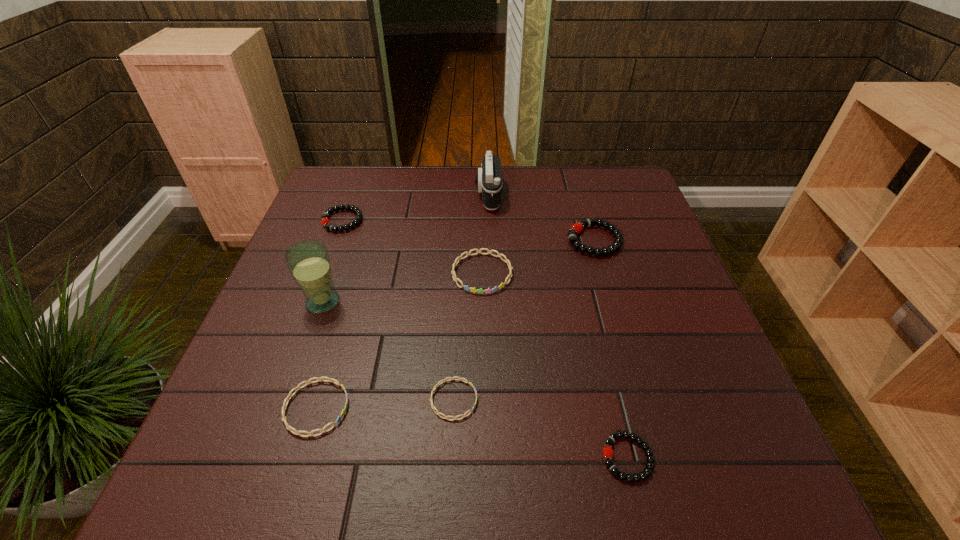
Where is `empty location between the second smallest black bracelet and the biggest black bracelet`? The width and height of the screenshot is (960, 540). empty location between the second smallest black bracelet and the biggest black bracelet is located at coordinates (468, 231).

Locate an element on the screen. The width and height of the screenshot is (960, 540). the second closest object to the leftmost blue bracelet is located at coordinates (308, 261).

Locate an element on the screen. The image size is (960, 540). the third closest object to the second biggest black bracelet is located at coordinates (489, 177).

At what (x,y) coordinates should I click in order to perform the action: click on bracelet that is the fifth closest to the nearest black bracelet. Please return your answer as a coordinate pair (x, y). The image size is (960, 540). Looking at the image, I should click on (325, 221).

In order to click on bracelet that is the fifth closest to the smallest black bracelet in this screenshot , I will do `click(325, 221)`.

Locate which black bracelet ranks second in proximity to the shortest object. Please provide its 2D coordinates. Your answer should be formatted as a tuple, i.e. [(x, y)], where the tuple contains the x and y coordinates of a point satisfying the conditions above.

[(577, 227)]

Locate an element on the screen. This screenshot has height=540, width=960. the closest black bracelet relative to the biggest blue bracelet is located at coordinates (577, 227).

At what (x,y) coordinates should I click in order to perform the action: click on blue bracelet identified as the closest to the shortest bracelet. Please return your answer as a coordinate pair (x, y). The width and height of the screenshot is (960, 540). Looking at the image, I should click on pos(333,380).

Identify which blue bracelet is the second closest to the blue glass. Please provide its 2D coordinates. Your answer should be formatted as a tuple, i.e. [(x, y)], where the tuple contains the x and y coordinates of a point satisfying the conditions above.

[(507, 261)]

Where is `free region that satisfies the following two spatial constraints: 1. on the surface of the biggest blue bracelet showing star-shaped elements; 2. on the surface of the second smallest blue bracelet showing star-shaped elements`? This screenshot has width=960, height=540. free region that satisfies the following two spatial constraints: 1. on the surface of the biggest blue bracelet showing star-shaped elements; 2. on the surface of the second smallest blue bracelet showing star-shaped elements is located at coordinates (483, 408).